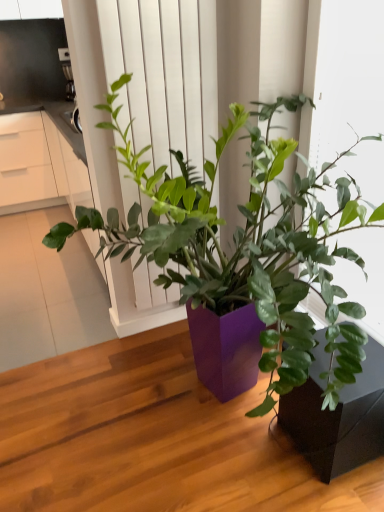
Question: Looking at the image, does white matte window frame at upper right seem bigger or smaller compared to matte black pot at lower right?

Choices:
 (A) small
 (B) big

Answer: (B)

Question: Looking at their shapes, would you say white matte window frame at upper right is wider or thinner than matte black pot at lower right?

Choices:
 (A) thin
 (B) wide

Answer: (A)

Question: Which object is the farthest from the brushed metal coffee maker at upper left?

Choices:
 (A) white matte screen door at center
 (B) matte black pot at lower right
 (C) purple matte planter at center
 (D) white matte window frame at upper right

Answer: (B)

Question: Which object is the closest to the white matte window frame at upper right?

Choices:
 (A) white matte screen door at center
 (B) brushed metal coffee maker at upper left
 (C) matte black pot at lower right
 (D) purple matte planter at center

Answer: (D)